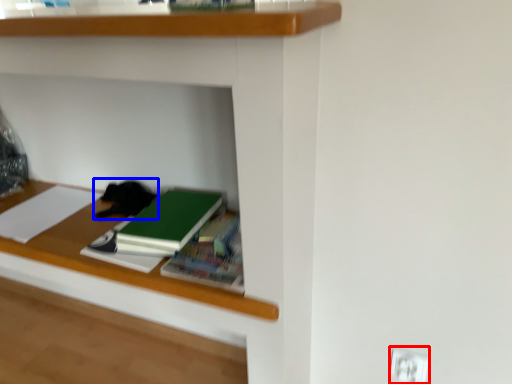
Question: Among these objects, which one is farthest to the camera, electric outlet (highlighted by a red box) or cat (highlighted by a blue box)?

Choices:
 (A) electric outlet
 (B) cat

Answer: (B)